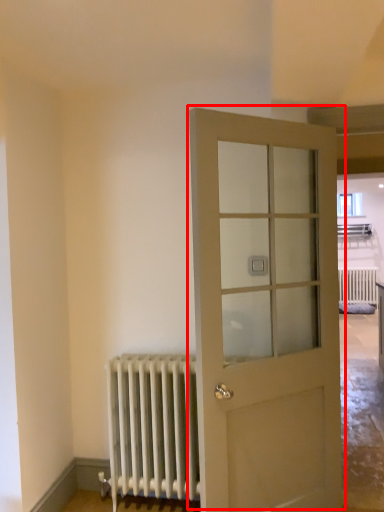
Question: Considering the relative positions of door (annotated by the red box) and radiator in the image provided, where is door (annotated by the red box) located with respect to the staircase?

Choices:
 (A) right
 (B) left

Answer: (A)